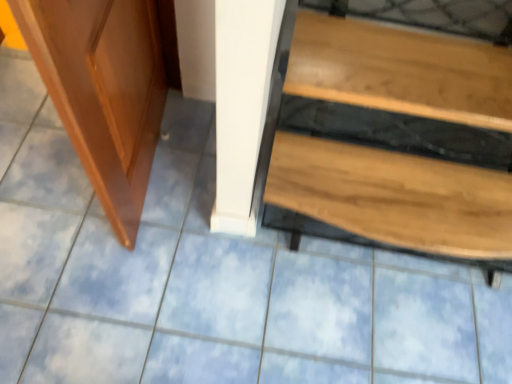
You are a GUI agent. You are given a task and a screenshot of the screen. Output one action in this format:
    pyautogui.click(x=<x>, y=<y>)
    Task: Click on the free point to the left of wooden table at lower right
    
    Given the screenshot: What is the action you would take?
    pyautogui.click(x=177, y=256)